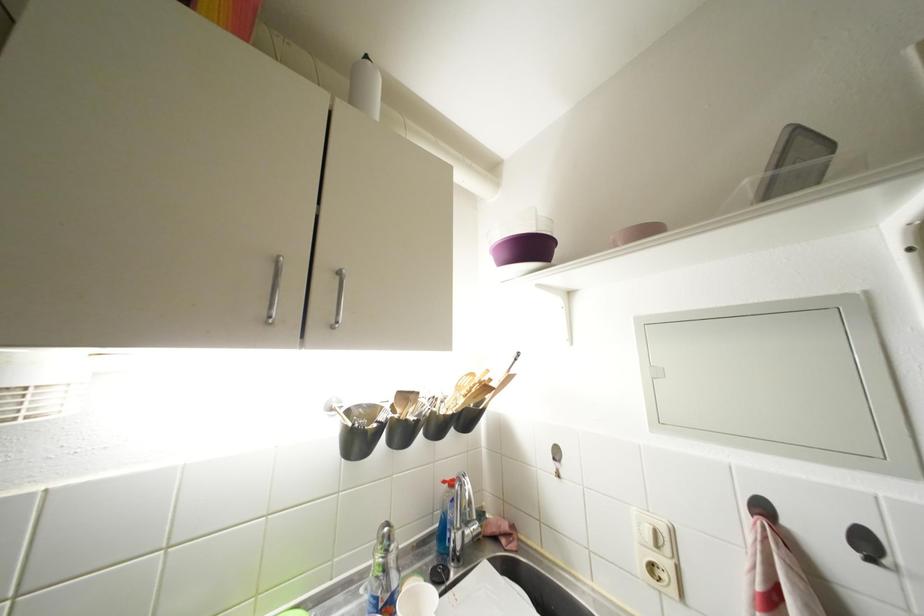
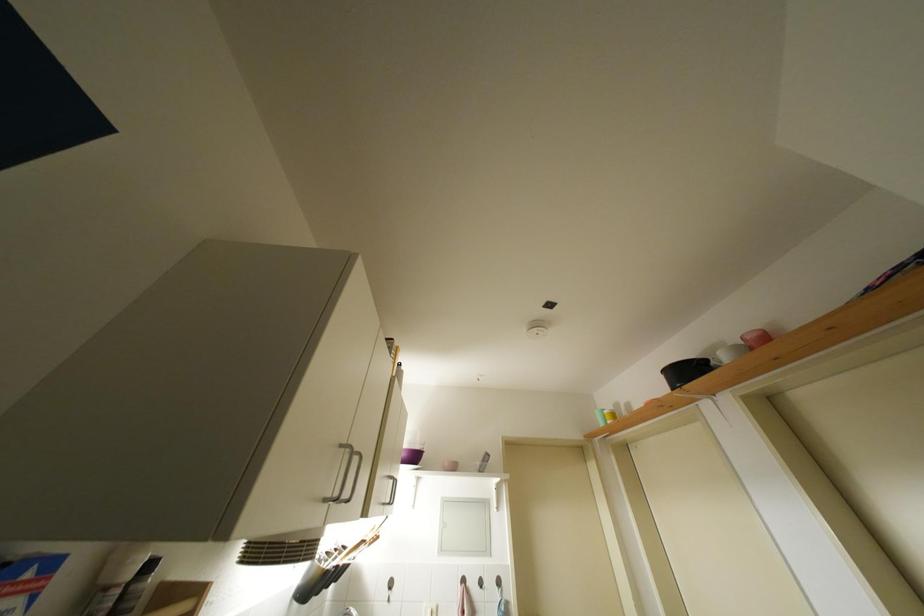
In the second image, find the point that corresponds to (512,259) in the first image.

(410, 459)